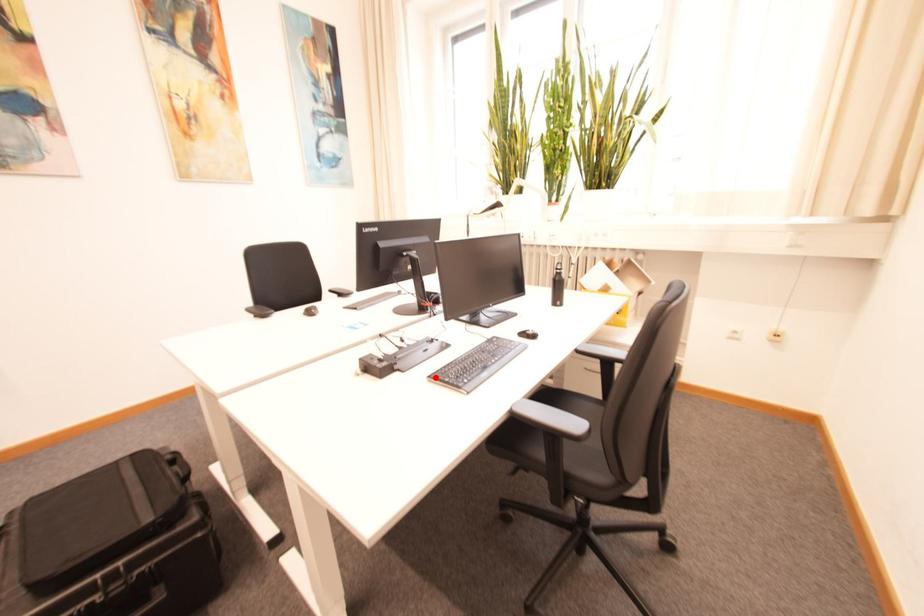
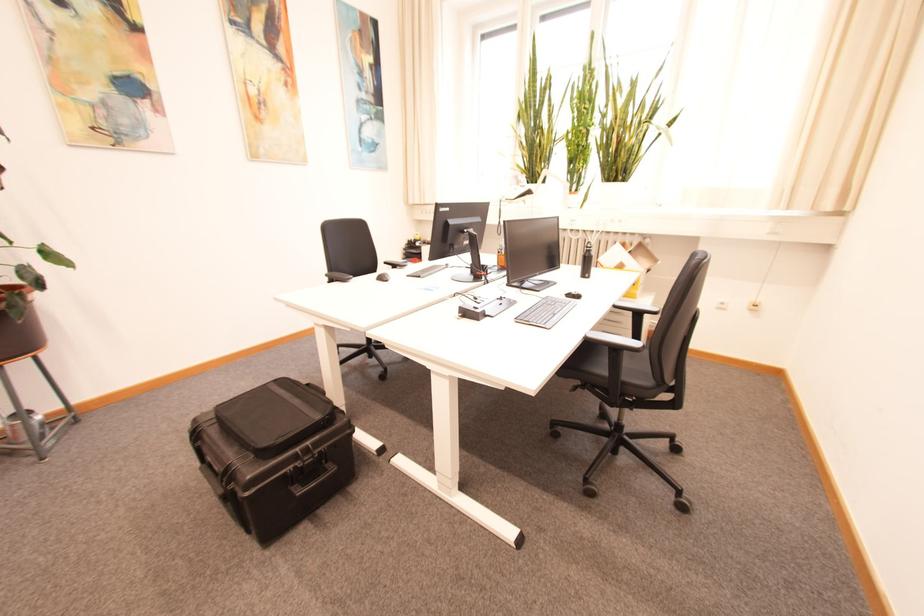
Locate, in the second image, the point that corresponds to the highlighted location in the first image.

(523, 320)